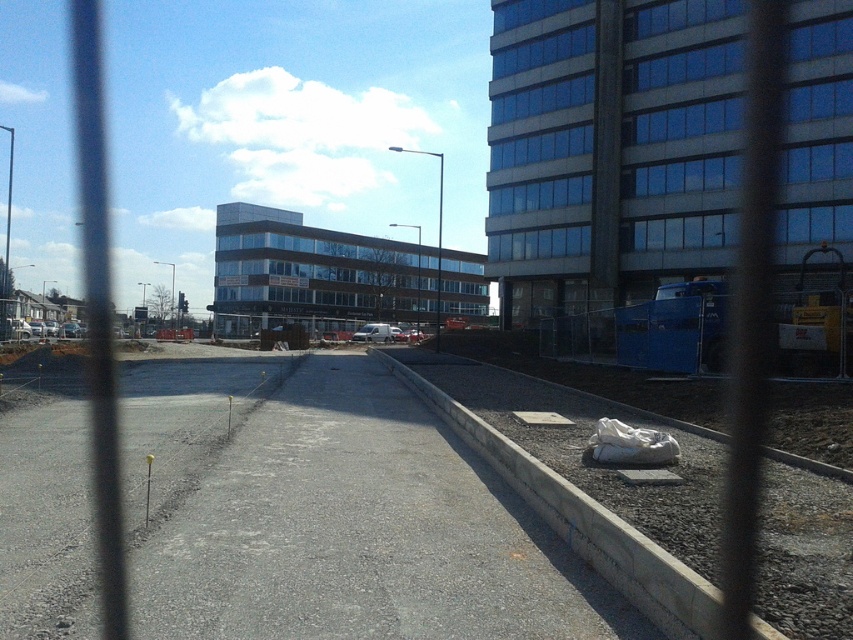
You are standing at the center of the image and want to place a small potted plant exactly at the position of the concrete at right. What are the coordinates where you should place the plant?

The coordinates for the concrete at right are at point (592, 461), so you should place the plant there.

You are a delivery drone operator. Your drone is at the point marked at (833, 68). You need to deliver a package to the building in the midground. The fence in front of you has vertical bars spaced 1.5 meters apart. Can your drone safely navigate through the fence to reach the building?

The fence bars are spaced 1.5 meters apart, and the distance between the drone and the building is 40.34 meters. Since the spacing between the bars is sufficient for the drone to pass through, the drone can navigate through the fence to reach the building.

You are standing at the point marked as point (610,150) in the image. Looking towards the glassy blue building at upper right, which direction should you face to see the building clearly through the fence?

You should face towards the upper right direction to see the glassy blue building at upper right clearly through the fence.